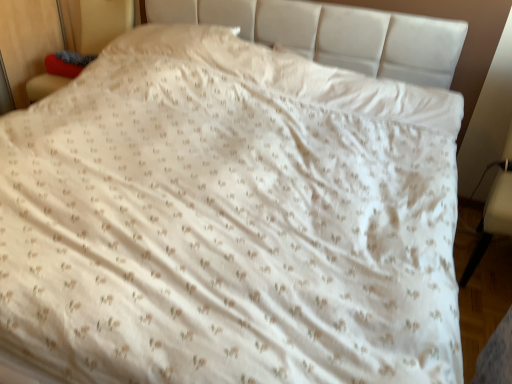
Question: Considering the relative sizes of white leather armchair at lower right, the 2th armchair viewed from the top, and matte red cushion at left, which is the 2th armchair in bottom-to-top order, in the image provided, is white leather armchair at lower right, the 2th armchair viewed from the top, smaller than matte red cushion at left, which is the 2th armchair in bottom-to-top order,?

Choices:
 (A) yes
 (B) no

Answer: (A)

Question: Is white leather armchair at lower right, the first armchair when ordered from bottom to top, next to matte red cushion at left, which is the first armchair in top-to-bottom order, and touching it?

Choices:
 (A) no
 (B) yes

Answer: (A)

Question: Is white leather armchair at lower right, which is counted as the 1th armchair, starting from the right, not close to matte red cushion at left, which is the 2th armchair in bottom-to-top order?

Choices:
 (A) yes
 (B) no

Answer: (A)

Question: Does white leather armchair at lower right, the first armchair when ordered from bottom to top, appear on the left side of matte red cushion at left, which is the 2th armchair in bottom-to-top order?

Choices:
 (A) no
 (B) yes

Answer: (A)

Question: Could you tell me if white leather armchair at lower right, the second armchair in the left-to-right sequence, is facing matte red cushion at left, which is the first armchair in top-to-bottom order?

Choices:
 (A) yes
 (B) no

Answer: (B)

Question: Would you say white leather armchair at lower right, which is counted as the 1th armchair, starting from the right, contains matte red cushion at left, the first armchair in the left-to-right sequence?

Choices:
 (A) yes
 (B) no

Answer: (B)

Question: Does matte red cushion at left, the first armchair in the left-to-right sequence, have a smaller size compared to white leather armchair at lower right, the second armchair in the left-to-right sequence?

Choices:
 (A) yes
 (B) no

Answer: (B)

Question: Is matte red cushion at left, which is the 2th armchair in bottom-to-top order, oriented towards white leather armchair at lower right, the 2th armchair viewed from the top?

Choices:
 (A) no
 (B) yes

Answer: (A)

Question: Is matte red cushion at left, which is the first armchair in top-to-bottom order, bigger than white leather armchair at lower right, the second armchair in the left-to-right sequence?

Choices:
 (A) no
 (B) yes

Answer: (B)

Question: Does matte red cushion at left, which is the first armchair in top-to-bottom order, have a lesser width compared to white leather armchair at lower right, the first armchair when ordered from bottom to top?

Choices:
 (A) no
 (B) yes

Answer: (B)

Question: Is matte red cushion at left, the first armchair in the left-to-right sequence, shorter than white leather armchair at lower right, which is counted as the 1th armchair, starting from the right?

Choices:
 (A) no
 (B) yes

Answer: (B)

Question: Considering the relative positions of matte red cushion at left, the first armchair in the left-to-right sequence, and white leather armchair at lower right, the first armchair when ordered from bottom to top, in the image provided, is matte red cushion at left, the first armchair in the left-to-right sequence, to the left of white leather armchair at lower right, the first armchair when ordered from bottom to top, from the viewer's perspective?

Choices:
 (A) yes
 (B) no

Answer: (A)

Question: Considering the positions of matte red cushion at left, the first armchair in the left-to-right sequence, and white leather armchair at lower right, the second armchair in the left-to-right sequence, in the image, is matte red cushion at left, the first armchair in the left-to-right sequence, taller or shorter than white leather armchair at lower right, the second armchair in the left-to-right sequence,?

Choices:
 (A) tall
 (B) short

Answer: (B)